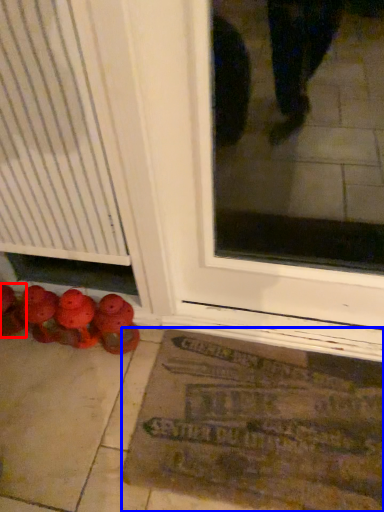
Question: Which object is further to the camera taking this photo, footwear (highlighted by a red box) or bath mat (highlighted by a blue box)?

Choices:
 (A) footwear
 (B) bath mat

Answer: (A)